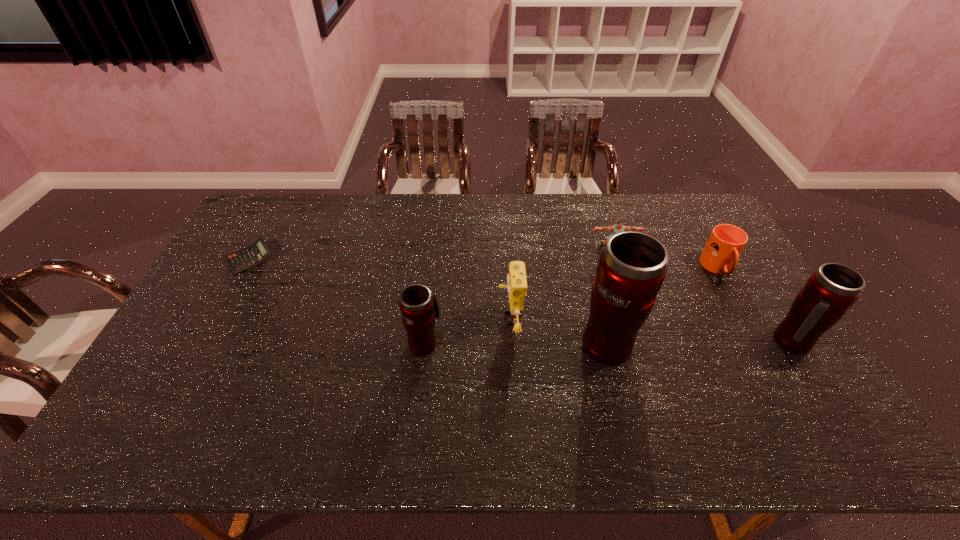
This screenshot has height=540, width=960. I want to click on the leftmost thermos bottle, so click(418, 305).

Where is `the sixth object from right to left`? The image size is (960, 540). the sixth object from right to left is located at coordinates (418, 305).

Identify the location of the tallest object. pos(631,269).

Image resolution: width=960 pixels, height=540 pixels. I want to click on the tallest thermos bottle, so click(631, 269).

The image size is (960, 540). Find the location of `the second tallest thermos bottle`. the second tallest thermos bottle is located at coordinates (830, 291).

I want to click on the second tallest object, so click(x=830, y=291).

This screenshot has width=960, height=540. What are the coordinates of `mug` in the screenshot? It's located at (721, 253).

Locate an element on the screen. Image resolution: width=960 pixels, height=540 pixels. calculator is located at coordinates (245, 259).

Locate an element on the screen. This screenshot has width=960, height=540. the leftmost object is located at coordinates (245, 259).

Find the location of `puncher`. puncher is located at coordinates (617, 228).